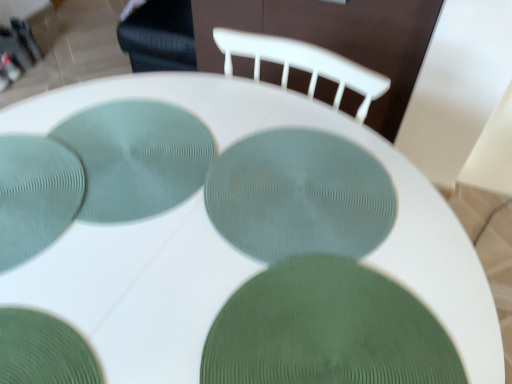
Identify the location of matte green plate at lower left, marked as the 5th glass plate in a right-to-left arrangement. (35, 195).

You are a GUI agent. You are given a task and a screenshot of the screen. Output one action in this format:
    pyautogui.click(x=<x>, y=<y>)
    Task: Click on the teal textured placemat at center, the third glass plate viewed from the left
    The image size is (512, 384).
    Given the screenshot: What is the action you would take?
    pyautogui.click(x=137, y=158)

Identify the location of green textured plate at center, marked as the 1th glass plate in a right-to-left arrangement. This screenshot has width=512, height=384. (326, 330).

From a real-world perspective, is green textured glass plate at lower left, which ranks as the second glass plate in left-to-right order, on top of matte green plate at lower left, marked as the 5th glass plate in a right-to-left arrangement?

No.

Considering their positions, is green textured glass plate at lower left, the fourth glass plate viewed from the right, located in front of or behind matte green plate at lower left, which is the first glass plate in left-to-right order?

Visually, green textured glass plate at lower left, the fourth glass plate viewed from the right, is located in front of matte green plate at lower left, which is the first glass plate in left-to-right order.

Considering the positions of objects green textured glass plate at lower left, the fourth glass plate viewed from the right, and teal textured placemat at center, which ranks as the third glass plate in right-to-left order, in the image provided, who is more to the right, green textured glass plate at lower left, the fourth glass plate viewed from the right, or teal textured placemat at center, which ranks as the third glass plate in right-to-left order,?

From the viewer's perspective, teal textured placemat at center, which ranks as the third glass plate in right-to-left order, appears more on the right side.

Does green textured glass plate at lower left, which ranks as the second glass plate in left-to-right order, turn towards teal textured placemat at center, which ranks as the third glass plate in right-to-left order?

No, green textured glass plate at lower left, which ranks as the second glass plate in left-to-right order, does not turn towards teal textured placemat at center, which ranks as the third glass plate in right-to-left order.

Is green textured glass plate at lower left, which ranks as the second glass plate in left-to-right order, outside of teal textured placemat at center, which ranks as the third glass plate in right-to-left order?

Yes, green textured glass plate at lower left, which ranks as the second glass plate in left-to-right order, is outside of teal textured placemat at center, which ranks as the third glass plate in right-to-left order.

How many degrees apart are the facing directions of green textured glass plate at lower left, the fourth glass plate viewed from the right, and teal textured placemat at center, the third glass plate viewed from the left?

The angular difference between green textured glass plate at lower left, the fourth glass plate viewed from the right, and teal textured placemat at center, the third glass plate viewed from the left, is 99 degrees.

From a real-world perspective, who is located lower, teal textured placemat at center, the third glass plate viewed from the left, or green textured plate at center, marked as the 1th glass plate in a right-to-left arrangement?

In real-world perspective, green textured plate at center, marked as the 1th glass plate in a right-to-left arrangement, is lower.

Is teal textured placemat at center, the third glass plate viewed from the left, shorter than green textured plate at center, marked as the 1th glass plate in a right-to-left arrangement?

No, teal textured placemat at center, the third glass plate viewed from the left, is not shorter than green textured plate at center, marked as the 1th glass plate in a right-to-left arrangement.

Between teal textured placemat at center, which ranks as the third glass plate in right-to-left order, and green textured plate at center, marked as the 1th glass plate in a right-to-left arrangement, which one has larger size?

With larger size is teal textured placemat at center, which ranks as the third glass plate in right-to-left order.

Is teal textured placemat at center, the third glass plate viewed from the left, next to green textured plate at center, marked as the 1th glass plate in a right-to-left arrangement, and touching it?

No, teal textured placemat at center, the third glass plate viewed from the left, is not in contact with green textured plate at center, marked as the 1th glass plate in a right-to-left arrangement.

Can you confirm if matte green plate at center, placed as the second glass plate when sorted from right to left, is bigger than green textured plate at center, marked as the 1th glass plate in a right-to-left arrangement?

Actually, matte green plate at center, placed as the second glass plate when sorted from right to left, might be smaller than green textured plate at center, marked as the 1th glass plate in a right-to-left arrangement.

Is matte green plate at center, acting as the fourth glass plate starting from the left, oriented towards green textured plate at center, marked as the 1th glass plate in a right-to-left arrangement?

No, matte green plate at center, acting as the fourth glass plate starting from the left, is not turned towards green textured plate at center, marked as the 1th glass plate in a right-to-left arrangement.

Between matte green plate at center, acting as the fourth glass plate starting from the left, and green textured plate at center, marked as the 1th glass plate in a right-to-left arrangement, which one is positioned in front?

Positioned in front is green textured plate at center, marked as the 1th glass plate in a right-to-left arrangement.

Is green textured plate at center, the 5th glass plate positioned from the left, next to matte green plate at lower left, which is the first glass plate in left-to-right order, and touching it?

No, green textured plate at center, the 5th glass plate positioned from the left, is not making contact with matte green plate at lower left, which is the first glass plate in left-to-right order.

From a real-world perspective, which object stands above the other?

From a 3D spatial view, matte green plate at lower left, which is the first glass plate in left-to-right order, is above.

Considering the sizes of green textured plate at center, marked as the 1th glass plate in a right-to-left arrangement, and matte green plate at lower left, which is the first glass plate in left-to-right order, in the image, is green textured plate at center, marked as the 1th glass plate in a right-to-left arrangement, wider or thinner than matte green plate at lower left, which is the first glass plate in left-to-right order,?

In the image, green textured plate at center, marked as the 1th glass plate in a right-to-left arrangement, appears to be wider than matte green plate at lower left, which is the first glass plate in left-to-right order.

Is teal textured placemat at center, the third glass plate viewed from the left, at the back of matte green plate at lower left, marked as the 5th glass plate in a right-to-left arrangement?

Yes, matte green plate at lower left, marked as the 5th glass plate in a right-to-left arrangement, is facing away from teal textured placemat at center, the third glass plate viewed from the left.

Between matte green plate at lower left, marked as the 5th glass plate in a right-to-left arrangement, and teal textured placemat at center, the third glass plate viewed from the left, which one is positioned behind?

teal textured placemat at center, the third glass plate viewed from the left, is more distant.

From a real-world perspective, is matte green plate at lower left, which is the first glass plate in left-to-right order, above or below teal textured placemat at center, which ranks as the third glass plate in right-to-left order?

In terms of real-world spatial position, matte green plate at lower left, which is the first glass plate in left-to-right order, is above teal textured placemat at center, which ranks as the third glass plate in right-to-left order.

Measure the distance from teal textured placemat at center, the third glass plate viewed from the left, to matte green plate at lower left, marked as the 5th glass plate in a right-to-left arrangement.

A distance of 4.45 inches exists between teal textured placemat at center, the third glass plate viewed from the left, and matte green plate at lower left, marked as the 5th glass plate in a right-to-left arrangement.

Is point (197, 163) farther from viewer compared to point (28, 241)?

Yes, it is.

Is matte green plate at lower left, marked as the 5th glass plate in a right-to-left arrangement, a part of teal textured placemat at center, the third glass plate viewed from the left?

No, matte green plate at lower left, marked as the 5th glass plate in a right-to-left arrangement, is located outside of teal textured placemat at center, the third glass plate viewed from the left.

From the teal textured placemat at center, which ranks as the third glass plate in right-to-left order, count the 2nd glass plate to the left and point to it. Please provide its 2D coordinates.

[(35, 195)]

From the image's perspective, starting from the matte green plate at lower left, marked as the 5th glass plate in a right-to-left arrangement, which glass plate is the 2nd one below? Please provide its 2D coordinates.

[(42, 351)]

From the image's perspective, starting from the green textured glass plate at lower left, the fourth glass plate viewed from the right, which glass plate is the 4th one above? Please provide its 2D coordinates.

[(137, 158)]

Estimate the real-world distances between objects in this image. Which object is closer to green textured glass plate at lower left, the fourth glass plate viewed from the right, teal textured placemat at center, the third glass plate viewed from the left, or green textured plate at center, the 5th glass plate positioned from the left?

The object closer to green textured glass plate at lower left, the fourth glass plate viewed from the right, is green textured plate at center, the 5th glass plate positioned from the left.

Considering their positions, is matte green plate at lower left, which is the first glass plate in left-to-right order, positioned closer to green textured glass plate at lower left, the fourth glass plate viewed from the right, than teal textured placemat at center, which ranks as the third glass plate in right-to-left order?

matte green plate at lower left, which is the first glass plate in left-to-right order, lies closer to green textured glass plate at lower left, the fourth glass plate viewed from the right, than the other object.

Estimate the real-world distances between objects in this image. Which object is further from matte green plate at lower left, marked as the 5th glass plate in a right-to-left arrangement, green textured glass plate at lower left, the fourth glass plate viewed from the right, or matte green plate at center, acting as the fourth glass plate starting from the left?

Among the two, matte green plate at center, acting as the fourth glass plate starting from the left, is located further to matte green plate at lower left, marked as the 5th glass plate in a right-to-left arrangement.

Based on their spatial positions, is matte green plate at lower left, which is the first glass plate in left-to-right order, or green textured glass plate at lower left, which ranks as the second glass plate in left-to-right order, further from matte green plate at center, placed as the second glass plate when sorted from right to left?

The object further to matte green plate at center, placed as the second glass plate when sorted from right to left, is green textured glass plate at lower left, which ranks as the second glass plate in left-to-right order.

When comparing their distances from green textured plate at center, the 5th glass plate positioned from the left, does green textured glass plate at lower left, the fourth glass plate viewed from the right, or matte green plate at lower left, marked as the 5th glass plate in a right-to-left arrangement, seem closer?

green textured glass plate at lower left, the fourth glass plate viewed from the right.

Based on their spatial positions, is green textured plate at center, marked as the 1th glass plate in a right-to-left arrangement, or green textured glass plate at lower left, which ranks as the second glass plate in left-to-right order, further from teal textured placemat at center, the third glass plate viewed from the left?

Based on the image, green textured plate at center, marked as the 1th glass plate in a right-to-left arrangement, appears to be further to teal textured placemat at center, the third glass plate viewed from the left.

From the image, which object appears to be nearer to green textured glass plate at lower left, which ranks as the second glass plate in left-to-right order, teal textured placemat at center, the third glass plate viewed from the left, or matte green plate at center, acting as the fourth glass plate starting from the left?

The object closer to green textured glass plate at lower left, which ranks as the second glass plate in left-to-right order, is teal textured placemat at center, the third glass plate viewed from the left.

When comparing their distances from green textured plate at center, the 5th glass plate positioned from the left, does matte green plate at center, placed as the second glass plate when sorted from right to left, or matte green plate at lower left, marked as the 5th glass plate in a right-to-left arrangement, seem closer?

matte green plate at center, placed as the second glass plate when sorted from right to left, lies closer to green textured plate at center, the 5th glass plate positioned from the left, than the other object.

Find the location of a particular element. glass plate between green textured glass plate at lower left, the fourth glass plate viewed from the right, and matte green plate at center, placed as the second glass plate when sorted from right to left is located at coordinates (137, 158).

The width and height of the screenshot is (512, 384). What are the coordinates of `glass plate located between teal textured placemat at center, the third glass plate viewed from the left, and green textured plate at center, the 5th glass plate positioned from the left, in the left-right direction` in the screenshot? It's located at pos(298,196).